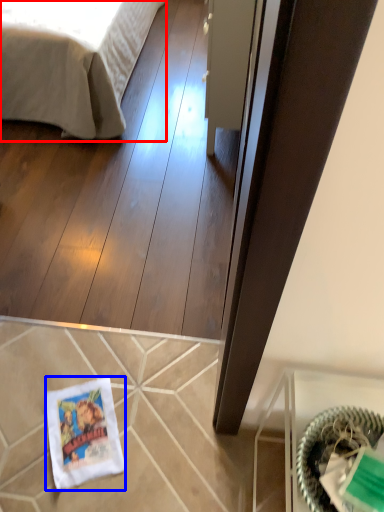
Question: Which point is further to the camera, bed (highlighted by a red box) or material (highlighted by a blue box)?

Choices:
 (A) bed
 (B) material

Answer: (A)